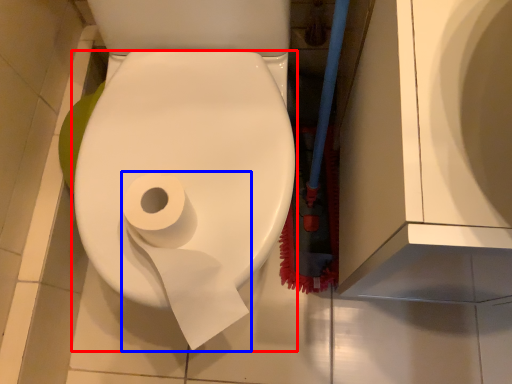
Question: Among these objects, which one is farthest to the camera, toilet paper (highlighted by a red box) or toilet paper (highlighted by a blue box)?

Choices:
 (A) toilet paper
 (B) toilet paper

Answer: (B)